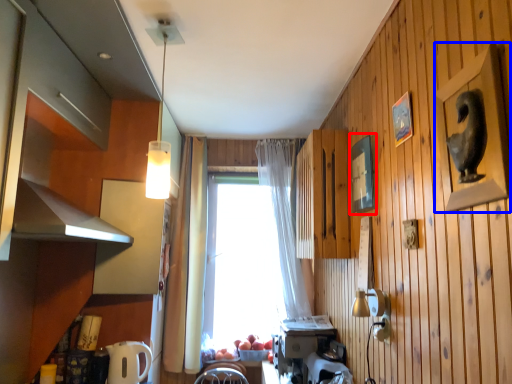
Question: Which point is further to the camera, picture frame (highlighted by a red box) or picture frame (highlighted by a blue box)?

Choices:
 (A) picture frame
 (B) picture frame

Answer: (A)